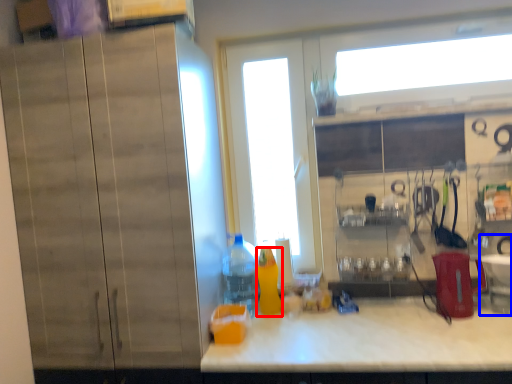
Question: Which object is further to the camera taking this photo, bottle (highlighted by a red box) or sink (highlighted by a blue box)?

Choices:
 (A) bottle
 (B) sink

Answer: (A)